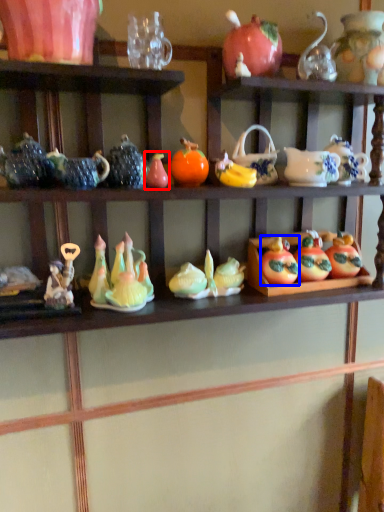
Question: Which object is closer to the camera taking this photo, toy (highlighted by a red box) or fruit (highlighted by a blue box)?

Choices:
 (A) toy
 (B) fruit

Answer: (A)